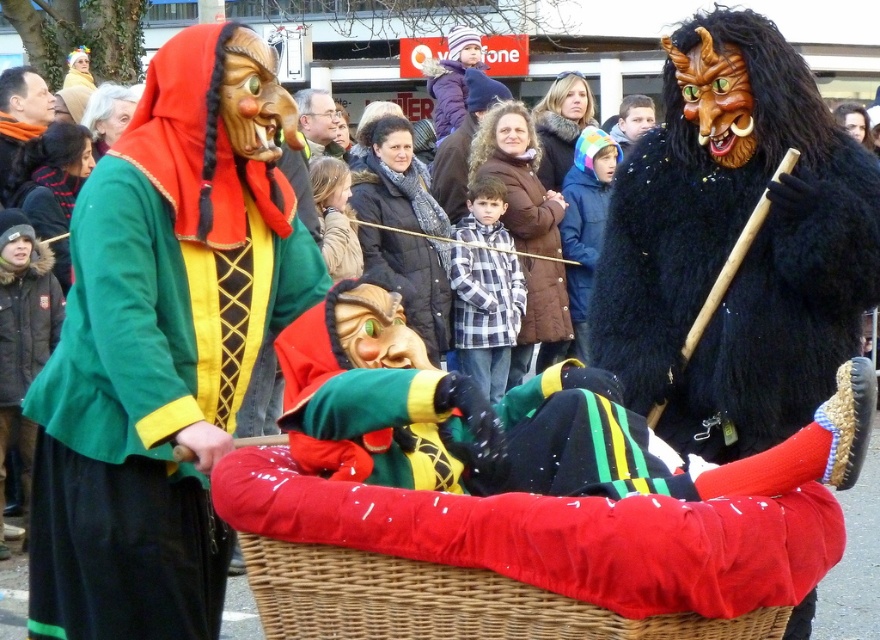
Question: Is woven wicker basket at center thinner than smooth brown leather jacket at upper center?

Choices:
 (A) no
 (B) yes

Answer: (A)

Question: Which point is farther from the camera taking this photo?

Choices:
 (A) pos(627,125)
 (B) pos(297,99)

Answer: (A)

Question: Which of the following is the closest to the observer?

Choices:
 (A) smooth brown leather jacket at upper center
 (B) woven wicker basket at center
 (C) green velvet mask at left

Answer: (B)

Question: Can you confirm if green velvet mask at left is positioned to the left of glossy plastic glasses at center?

Choices:
 (A) no
 (B) yes

Answer: (A)

Question: Does glossy plastic glasses at center have a lesser width compared to smooth brown leather jacket at upper center?

Choices:
 (A) yes
 (B) no

Answer: (B)

Question: Which point is farther from the camera taking this photo?

Choices:
 (A) (330, 138)
 (B) (433, 572)
 (C) (631, 128)

Answer: (C)